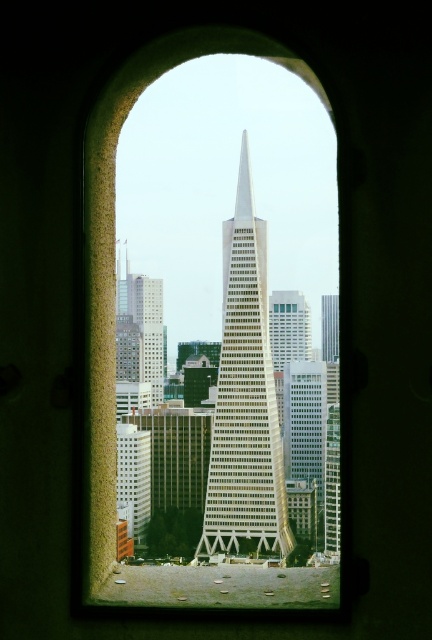
You are an architect designing a new building and want to ensure it doesn not block the view of the white glass skyscraper at center and the glassy reflective skyscraper at center from the arched window. Which of the two buildings should you prioritize preserving the view of, based on their widths?

The white glass skyscraper at center is wider than the glassy reflective skyscraper at center, so you should prioritize preserving the view of the white glass skyscraper at center to ensure the larger structure remains visible.

Based on the photo, you are an architect analyzing the cityscape through the arched window. You notice the white glass skyscraper at center and the glassy reflective skyscraper at center. Which one has a greater height?

The white glass skyscraper at center is much taller than the glassy reflective skyscraper at center according to the description.